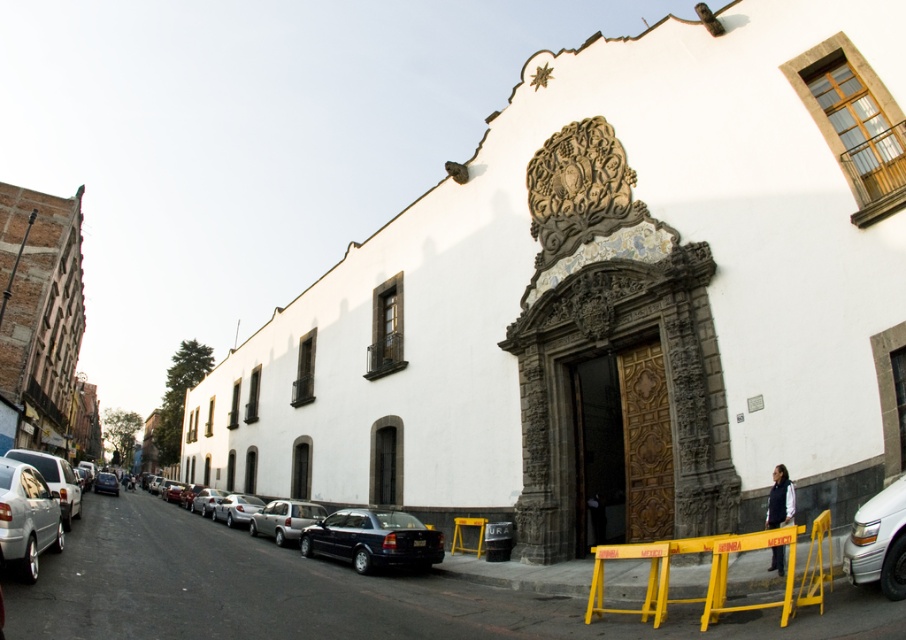
Between point (830, 554) and point (338, 512), which one is positioned behind?

The point (338, 512) is behind.

Looking at this image, can you confirm if yellow plastic barricade at lower center is positioned below shiny black sedan at center?

Incorrect, yellow plastic barricade at lower center is not positioned below shiny black sedan at center.

Which is behind, point (788, 528) or point (376, 552)?

The point (376, 552) is behind.

The width and height of the screenshot is (906, 640). Find the location of `yellow plastic barricade at lower center`. yellow plastic barricade at lower center is located at coordinates (718, 572).

Can you confirm if yellow plastic barricade at lower center is positioned below silver metallic van at left?

Correct, yellow plastic barricade at lower center is located below silver metallic van at left.

Can you confirm if yellow plastic barricade at lower center is positioned to the right of silver metallic van at left?

Indeed, yellow plastic barricade at lower center is positioned on the right side of silver metallic van at left.

Is point (736, 541) positioned in front of point (36, 502)?

Yes, point (736, 541) is in front of point (36, 502).

You are a GUI agent. You are given a task and a screenshot of the screen. Output one action in this format:
    pyautogui.click(x=<x>, y=<y>)
    Task: Click on the yellow plastic barricade at lower center
    This screenshot has height=640, width=906.
    Given the screenshot: What is the action you would take?
    pyautogui.click(x=718, y=572)

From the picture: Does silver metallic van at left have a lesser width compared to satin silver car at center?

Correct, silver metallic van at left's width is less than satin silver car at center's.

Which of these two, silver metallic van at left or satin silver car at center, stands shorter?

silver metallic van at left

Does point (14, 541) come closer to viewer compared to point (284, 513)?

Yes, point (14, 541) is closer to viewer.

Image resolution: width=906 pixels, height=640 pixels. What are the coordinates of `silver metallic van at left` in the screenshot? It's located at (26, 518).